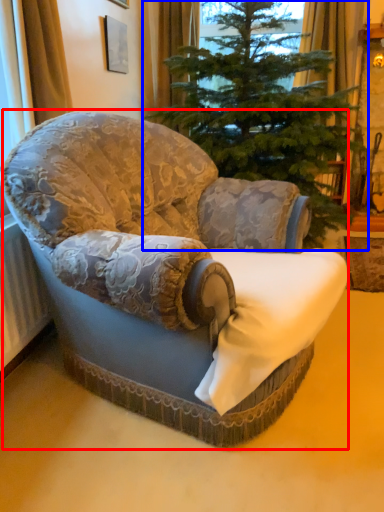
Question: Among these objects, which one is farthest to the camera, chair (highlighted by a red box) or christmas tree (highlighted by a blue box)?

Choices:
 (A) chair
 (B) christmas tree

Answer: (B)